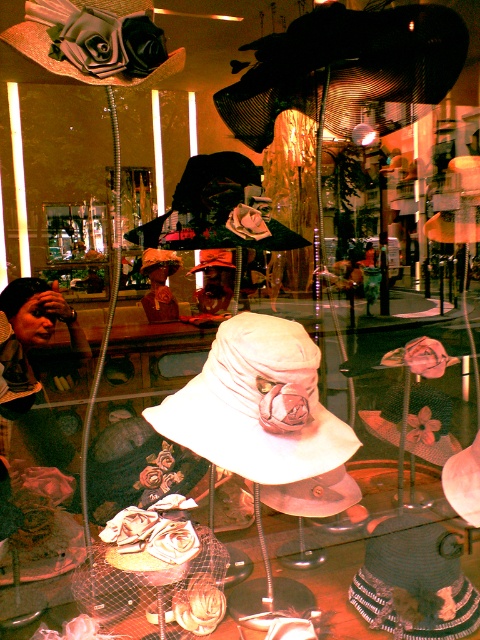
You are a customer in the store looking at the hats through the window. You want to pick up the white matte baseball hat at center and the matte black baseball hat at upper left. Which hat will you need to reach further into the window display to get?

The matte black baseball hat at upper left is further away from you, so you will need to reach further into the window display to get the matte black baseball hat at upper left.

You are a customer in a hat shop and you want to buy the white fabric hat at center and the white matte baseball hat at center. The shopkeeper tells you that the hat on the right side of the display is on sale. Which hat should you choose?

The white fabric hat at center is to the right of the white matte baseball hat at center, so the white fabric hat at center is on the right side of the display and therefore on sale.